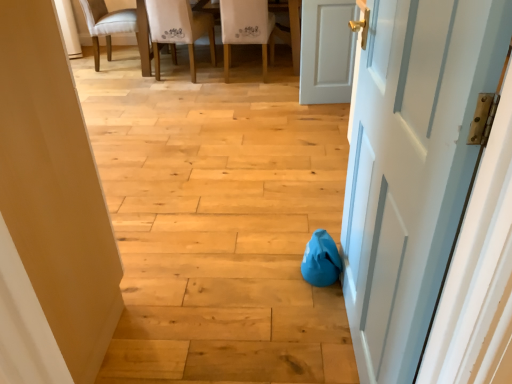
The image size is (512, 384). What do you see at coordinates (118, 28) in the screenshot? I see `light beige fabric chair at upper left, placed as the third chair when sorted from right to left` at bounding box center [118, 28].

How much space does white fabric chair at upper center, marked as the second chair in a left-to-right arrangement, occupy horizontally?

The width of white fabric chair at upper center, marked as the second chair in a left-to-right arrangement, is 22.69 inches.

This screenshot has width=512, height=384. What do you see at coordinates (178, 29) in the screenshot?
I see `white fabric chair at upper center, marked as the second chair in a right-to-left arrangement` at bounding box center [178, 29].

Where is `white fabric chair at upper center, which is counted as the first chair, starting from the right`? The width and height of the screenshot is (512, 384). white fabric chair at upper center, which is counted as the first chair, starting from the right is located at coordinates (247, 29).

Find the location of `white painted wood door at right, the second door from the right`. white painted wood door at right, the second door from the right is located at coordinates (412, 167).

Describe the element at coordinates (327, 51) in the screenshot. I see `white matte door at right, which ranks as the first door in back-to-front order` at that location.

Locate an element on the screen. The image size is (512, 384). light beige fabric chair at upper left, which is the first chair in left-to-right order is located at coordinates (118, 28).

Measure the distance from white matte door at right, the 3th door from the front, to white fabric chair at upper center, which ranks as the 3th chair in left-to-right order.

They are 29.28 inches apart.

Consider the image. How different are the orientations of white matte door at right, which ranks as the first door in back-to-front order, and white fabric chair at upper center, which ranks as the 3th chair in left-to-right order, in degrees?

The facing directions of white matte door at right, which ranks as the first door in back-to-front order, and white fabric chair at upper center, which ranks as the 3th chair in left-to-right order, are 174 degrees apart.

Which is behind, point (339, 79) or point (226, 0)?

The point (226, 0) is more distant.

From the image's perspective, is white matte door at right, the 3th door from the front, under white fabric chair at upper center, which ranks as the 3th chair in left-to-right order?

Correct, white matte door at right, the 3th door from the front, appears lower than white fabric chair at upper center, which ranks as the 3th chair in left-to-right order, in the image.

Is white painted wood door at right, which is the first door in front-to-back order, not near white fabric chair at upper center, which is counted as the first chair, starting from the right?

Yes, white painted wood door at right, which is the first door in front-to-back order, is far from white fabric chair at upper center, which is counted as the first chair, starting from the right.

Who is smaller, white painted wood door at right, arranged as the third door when viewed from the back, or white fabric chair at upper center, which is counted as the first chair, starting from the right?

With smaller size is white painted wood door at right, arranged as the third door when viewed from the back.

Considering the sizes of objects white painted wood door at right, the second door from the right, and white fabric chair at upper center, which is counted as the first chair, starting from the right, in the image provided, who is wider, white painted wood door at right, the second door from the right, or white fabric chair at upper center, which is counted as the first chair, starting from the right,?

Wider between the two is white fabric chair at upper center, which is counted as the first chair, starting from the right.

Considering the relative positions of matte white door at center, the 2th door in the back-to-front sequence, and light beige fabric chair at upper left, which is the first chair in left-to-right order, in the image provided, is matte white door at center, the 2th door in the back-to-front sequence, to the left of light beige fabric chair at upper left, which is the first chair in left-to-right order, from the viewer's perspective?

No, matte white door at center, the 2th door in the back-to-front sequence, is not to the left of light beige fabric chair at upper left, which is the first chair in left-to-right order.

What's the angular difference between matte white door at center, acting as the first door starting from the left, and light beige fabric chair at upper left, which is the first chair in left-to-right order,'s facing directions?

There is a 90-degree angle between the facing directions of matte white door at center, acting as the first door starting from the left, and light beige fabric chair at upper left, which is the first chair in left-to-right order.

Consider the image. Does matte white door at center, the 3th door from the right, touch light beige fabric chair at upper left, which is the first chair in left-to-right order?

They are not placed beside each other.

Which of these two, matte white door at center, acting as the first door starting from the left, or light beige fabric chair at upper left, placed as the third chair when sorted from right to left, is smaller?

light beige fabric chair at upper left, placed as the third chair when sorted from right to left, is smaller.

From the image's perspective, which is above, matte white door at center, placed as the second door when sorted from front to back, or white matte door at right, the 3th door from the front?

From the image's view, white matte door at right, the 3th door from the front, is above.

Between point (2, 22) and point (317, 92), which one is positioned in front?

Positioned in front is point (2, 22).

Which is more to the right, matte white door at center, placed as the second door when sorted from front to back, or white matte door at right, which is counted as the first door, starting from the right?

Positioned to the right is white matte door at right, which is counted as the first door, starting from the right.

From a real-world perspective, who is located higher, light beige fabric chair at upper left, which is the first chair in left-to-right order, or white fabric chair at upper center, which ranks as the 3th chair in left-to-right order?

white fabric chair at upper center, which ranks as the 3th chair in left-to-right order, from a real-world perspective.

Does point (131, 15) appear closer or farther from the camera than point (238, 29)?

Point (131, 15).

Would you consider light beige fabric chair at upper left, which is the first chair in left-to-right order, to be distant from white fabric chair at upper center, which is counted as the first chair, starting from the right?

light beige fabric chair at upper left, which is the first chair in left-to-right order, is positioned a significant distance from white fabric chair at upper center, which is counted as the first chair, starting from the right.

Are white fabric chair at upper center, marked as the second chair in a right-to-left arrangement, and matte white door at center, acting as the first door starting from the left, located far from each other?

Yes, white fabric chair at upper center, marked as the second chair in a right-to-left arrangement, and matte white door at center, acting as the first door starting from the left, are quite far apart.

In the scene shown: Can you confirm if white fabric chair at upper center, marked as the second chair in a right-to-left arrangement, is wider than matte white door at center, the 3th door from the right?

No, white fabric chair at upper center, marked as the second chair in a right-to-left arrangement, is not wider than matte white door at center, the 3th door from the right.

I want to click on the 2nd chair behind the matte white door at center, placed as the second door when sorted from front to back, so click(x=178, y=29).

Is white fabric chair at upper center, marked as the second chair in a right-to-left arrangement, closer to the viewer compared to matte white door at center, acting as the first door starting from the left?

That is False.

Is light beige fabric chair at upper left, which is the first chair in left-to-right order, turned away from white painted wood door at right, the second door from the right?

No, white painted wood door at right, the second door from the right, is not at the back of light beige fabric chair at upper left, which is the first chair in left-to-right order.

Is white painted wood door at right, which is the first door in front-to-back order, surrounded by light beige fabric chair at upper left, which is the first chair in left-to-right order?

No, white painted wood door at right, which is the first door in front-to-back order, is not inside light beige fabric chair at upper left, which is the first chair in left-to-right order.

Is light beige fabric chair at upper left, placed as the third chair when sorted from right to left, not close to white painted wood door at right, the second door from the right?

Yes, light beige fabric chair at upper left, placed as the third chair when sorted from right to left, and white painted wood door at right, the second door from the right, are quite far apart.

Is point (140, 45) less distant than point (358, 238)?

No, (140, 45) is further to viewer.

You are a GUI agent. You are given a task and a screenshot of the screen. Output one action in this format:
    pyautogui.click(x=<x>, y=<y>)
    Task: Click on the 1st door positioned above the white fabric chair at upper center, which ranks as the 3th chair in left-to-right order (from a real-world perspective)
    The image size is (512, 384).
    Given the screenshot: What is the action you would take?
    pyautogui.click(x=327, y=51)

Starting from the white fabric chair at upper center, which ranks as the 3th chair in left-to-right order, which door is the 3rd one in front? Please provide its 2D coordinates.

[(412, 167)]

Considering their positions, is white fabric chair at upper center, which is counted as the first chair, starting from the right, positioned closer to light beige fabric chair at upper left, placed as the third chair when sorted from right to left, than matte white door at center, the 2th door in the back-to-front sequence?

The object closer to light beige fabric chair at upper left, placed as the third chair when sorted from right to left, is white fabric chair at upper center, which is counted as the first chair, starting from the right.

Consider the image. Considering their positions, is matte white door at center, the 3th door from the right, positioned closer to white fabric chair at upper center, which ranks as the 3th chair in left-to-right order, than light beige fabric chair at upper left, placed as the third chair when sorted from right to left?

light beige fabric chair at upper left, placed as the third chair when sorted from right to left, is closer to white fabric chair at upper center, which ranks as the 3th chair in left-to-right order.

When comparing their distances from white painted wood door at right, arranged as the third door when viewed from the back, does white fabric chair at upper center, marked as the second chair in a left-to-right arrangement, or white matte door at right, the 3th door from the front, seem further?

Among the two, white fabric chair at upper center, marked as the second chair in a left-to-right arrangement, is located further to white painted wood door at right, arranged as the third door when viewed from the back.

Looking at this image, from the image, which object appears to be nearer to white painted wood door at right, the second door from the right, light beige fabric chair at upper left, which is the first chair in left-to-right order, or white matte door at right, which is the third door from left to right?

white matte door at right, which is the third door from left to right, is closer to white painted wood door at right, the second door from the right.

Based on their spatial positions, is white fabric chair at upper center, marked as the second chair in a right-to-left arrangement, or light beige fabric chair at upper left, which is the first chair in left-to-right order, further from white matte door at right, the 3th door from the front?

light beige fabric chair at upper left, which is the first chair in left-to-right order, is positioned further to the anchor white matte door at right, the 3th door from the front.

When comparing their distances from white matte door at right, which is the third door from left to right, does matte white door at center, the 2th door in the back-to-front sequence, or white fabric chair at upper center, marked as the second chair in a right-to-left arrangement, seem closer?

The object closer to white matte door at right, which is the third door from left to right, is white fabric chair at upper center, marked as the second chair in a right-to-left arrangement.

Looking at this image, estimate the real-world distances between objects in this image. Which object is further from white painted wood door at right, which is counted as the second door, starting from the left, white matte door at right, which is the third door from left to right, or light beige fabric chair at upper left, which is the first chair in left-to-right order?

light beige fabric chair at upper left, which is the first chair in left-to-right order.

Which object lies further to the anchor point white painted wood door at right, the second door from the right, white fabric chair at upper center, marked as the second chair in a left-to-right arrangement, or light beige fabric chair at upper left, which is the first chair in left-to-right order?

The object further to white painted wood door at right, the second door from the right, is light beige fabric chair at upper left, which is the first chair in left-to-right order.

Where is `chair between light beige fabric chair at upper left, placed as the third chair when sorted from right to left, and white fabric chair at upper center, which ranks as the 3th chair in left-to-right order, from left to right`? The image size is (512, 384). chair between light beige fabric chair at upper left, placed as the third chair when sorted from right to left, and white fabric chair at upper center, which ranks as the 3th chair in left-to-right order, from left to right is located at coordinates (178, 29).

Locate an element on the screen. This screenshot has width=512, height=384. chair between white painted wood door at right, arranged as the third door when viewed from the back, and white fabric chair at upper center, marked as the second chair in a right-to-left arrangement, along the z-axis is located at coordinates (247, 29).

Identify the location of door located between matte white door at center, acting as the first door starting from the left, and light beige fabric chair at upper left, which is the first chair in left-to-right order, in the depth direction. The height and width of the screenshot is (384, 512). (327, 51).

Where is `door between matte white door at center, acting as the first door starting from the left, and white fabric chair at upper center, which is counted as the first chair, starting from the right, along the z-axis`? This screenshot has height=384, width=512. door between matte white door at center, acting as the first door starting from the left, and white fabric chair at upper center, which is counted as the first chair, starting from the right, along the z-axis is located at coordinates (327, 51).